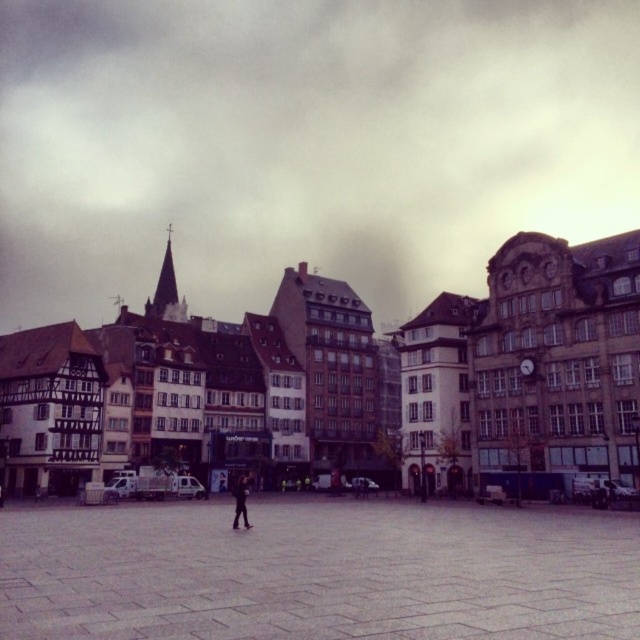
The height and width of the screenshot is (640, 640). I want to click on wooden timber buildings at center, so click(346, 381).

Who is shorter, wooden timber buildings at center or dark gray fabric jacket at center?

dark gray fabric jacket at center is shorter.

Image resolution: width=640 pixels, height=640 pixels. What do you see at coordinates (346, 381) in the screenshot?
I see `wooden timber buildings at center` at bounding box center [346, 381].

Where is `wooden timber buildings at center`? The width and height of the screenshot is (640, 640). wooden timber buildings at center is located at coordinates (346, 381).

Does point (136, 109) come closer to viewer compared to point (460, 342)?

No, it is behind (460, 342).

Does cloudy sky at upper center have a lesser width compared to wooden timber buildings at center?

No.

Does point (339, 156) come in front of point (420, 412)?

No, (339, 156) is further to viewer.

Identify the location of cloudy sky at upper center. The width and height of the screenshot is (640, 640). (301, 145).

Which is more to the left, wooden timber buildings at center or gray stone pavement at center?

From the viewer's perspective, wooden timber buildings at center appears more on the left side.

Is wooden timber buildings at center smaller than gray stone pavement at center?

Incorrect, wooden timber buildings at center is not smaller in size than gray stone pavement at center.

The width and height of the screenshot is (640, 640). Identify the location of wooden timber buildings at center. (346, 381).